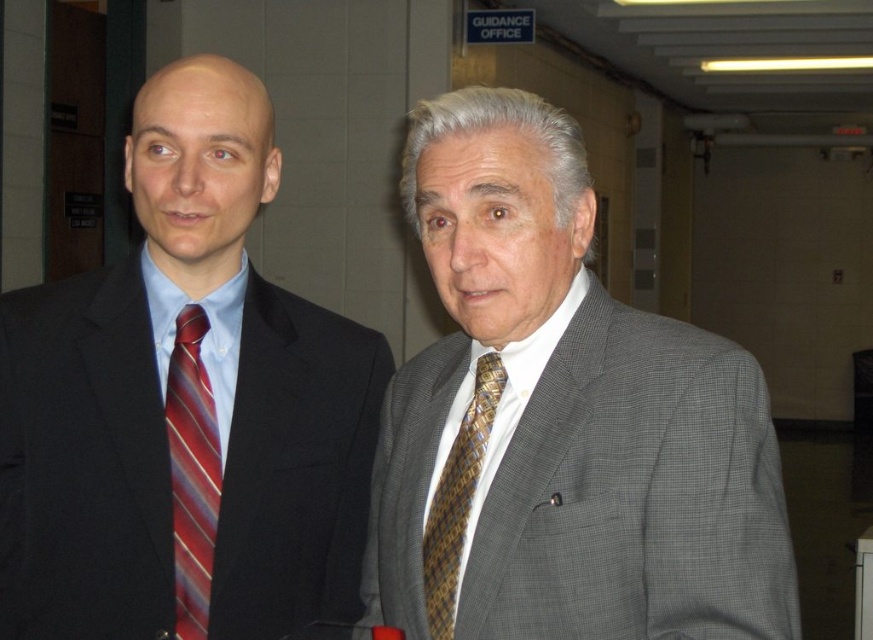
You are a tailor who needs to determine which item requires more fabric for alterations. Based on the image, which item is larger in size between the gray textured suit at center and the striped silk tie at left?

The gray textured suit at center is larger in size than the striped silk tie at left, so it requires more fabric for alterations.

You are a photographer standing in the hallway and want to capture a photo that includes both the gray textured suit at center and the brown woven tie at center. Based on their positions, which object should you focus on first to ensure both are in frame?

A: The gray textured suit at center is located above the brown woven tie at center, so you should focus on the gray textured suit at center first to ensure both are in frame.

You are a photographer trying to capture the man in the gray checkered suit at center. You see a point marked at coordinates (561, 420). Is this point located on the man in the gray checkered suit at center?

Yes, the point at (561, 420) is located on the gray textured suit at center, which belongs to the man in the gray checkered suit at center.